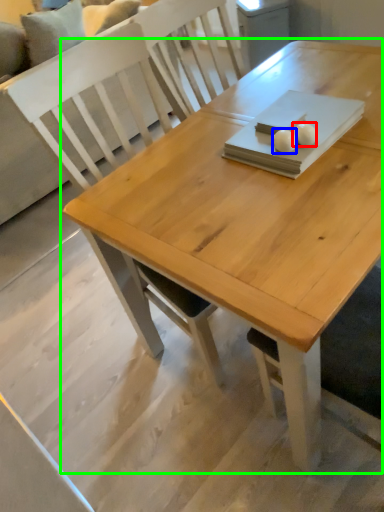
Question: Considering the real-world distances, which object is farthest from food (highlighted by a red box)? food (highlighted by a blue box) or table (highlighted by a green box)?

Choices:
 (A) food
 (B) table

Answer: (B)